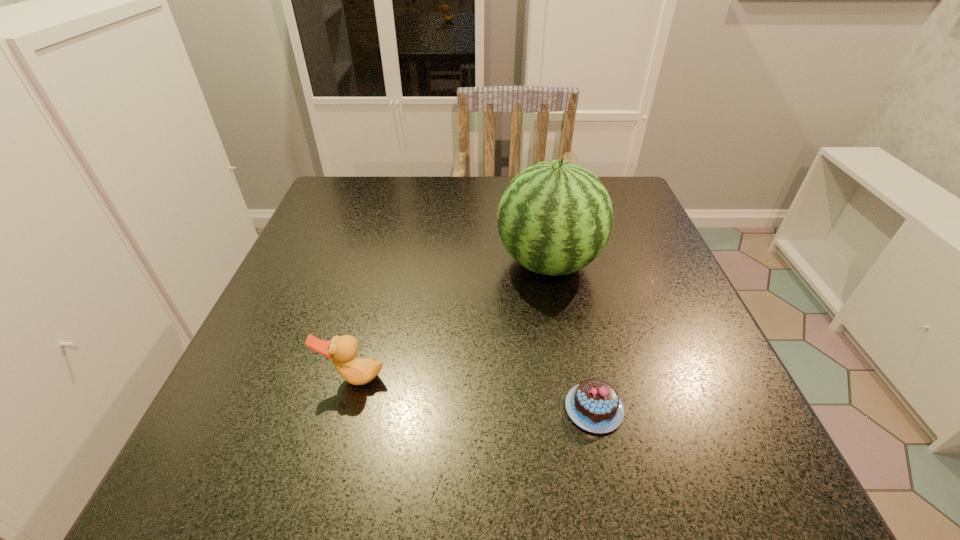
You are a GUI agent. You are given a task and a screenshot of the screen. Output one action in this format:
    pyautogui.click(x=<x>, y=<y>)
    Task: Click on the tallest object
    Image resolution: width=960 pixels, height=540 pixels.
    Given the screenshot: What is the action you would take?
    pyautogui.click(x=555, y=217)

This screenshot has width=960, height=540. I want to click on watermelon, so click(555, 217).

Identify the location of the second tallest object. (342, 350).

Identify the location of the leftmost object. The height and width of the screenshot is (540, 960). (342, 350).

Locate an element on the screen. This screenshot has width=960, height=540. chocolate cake is located at coordinates click(x=594, y=405).

The height and width of the screenshot is (540, 960). What are the coordinates of `vacant area located 0.320m on the left of the farthest object` in the screenshot? It's located at (347, 263).

The height and width of the screenshot is (540, 960). What are the coordinates of `vacant space located on the beak of the duck` in the screenshot? It's located at (340, 430).

What are the coordinates of `free space located on the back of the chocolate cake` in the screenshot? It's located at 577,333.

The width and height of the screenshot is (960, 540). I want to click on object present at the left edge, so click(342, 350).

Image resolution: width=960 pixels, height=540 pixels. I want to click on object at the right edge, so click(555, 217).